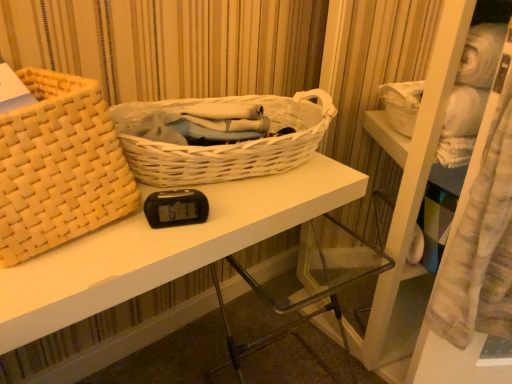
Question: Considering the relative positions of white wicker basket at center, acting as the 2th picnic basket starting from the left, and white woven basket at upper left in the image provided, is white wicker basket at center, acting as the 2th picnic basket starting from the left, to the right of white woven basket at upper left from the viewer's perspective?

Choices:
 (A) no
 (B) yes

Answer: (B)

Question: Can you see white wicker basket at center, acting as the 2th picnic basket starting from the left, touching white woven basket at upper left?

Choices:
 (A) yes
 (B) no

Answer: (B)

Question: Is white wicker basket at center, acting as the 2th picnic basket starting from the left, facing away from white woven basket at upper left?

Choices:
 (A) yes
 (B) no

Answer: (B)

Question: Would you say white woven basket at upper left is part of white wicker basket at center, arranged as the first picnic basket when viewed from the right,'s contents?

Choices:
 (A) no
 (B) yes

Answer: (A)

Question: Considering the relative sizes of white wicker basket at center, acting as the 2th picnic basket starting from the left, and white woven basket at upper left in the image provided, is white wicker basket at center, acting as the 2th picnic basket starting from the left, taller than white woven basket at upper left?

Choices:
 (A) yes
 (B) no

Answer: (B)

Question: Relative to white woven basket at upper left, is white wicker basket at center, acting as the 2th picnic basket starting from the left, in front or behind?

Choices:
 (A) behind
 (B) front

Answer: (A)

Question: From the image's perspective, relative to white woven basket at upper left, is white wicker basket at center, acting as the 2th picnic basket starting from the left, above or below?

Choices:
 (A) below
 (B) above

Answer: (B)

Question: Is white wicker basket at center, arranged as the first picnic basket when viewed from the right, wider or thinner than white woven basket at upper left?

Choices:
 (A) thin
 (B) wide

Answer: (A)

Question: Considering the positions of white wicker basket at center, acting as the 2th picnic basket starting from the left, and white woven basket at upper left in the image, is white wicker basket at center, acting as the 2th picnic basket starting from the left, bigger or smaller than white woven basket at upper left?

Choices:
 (A) small
 (B) big

Answer: (A)

Question: In terms of width, does white woven basket at upper left look wider or thinner when compared to matte woven picnic basket at left, positioned as the 1th picnic basket in left-to-right order?

Choices:
 (A) thin
 (B) wide

Answer: (B)

Question: Relative to matte woven picnic basket at left, positioned as the 1th picnic basket in left-to-right order, is white woven basket at upper left in front or behind?

Choices:
 (A) behind
 (B) front

Answer: (A)

Question: Is white woven basket at upper left to the left or to the right of matte woven picnic basket at left, positioned as the 1th picnic basket in left-to-right order, in the image?

Choices:
 (A) left
 (B) right

Answer: (B)

Question: Would you say white woven basket at upper left is inside or outside matte woven picnic basket at left, positioned as the 1th picnic basket in left-to-right order?

Choices:
 (A) outside
 (B) inside

Answer: (A)

Question: Looking at the image, does white wicker basket at center, arranged as the first picnic basket when viewed from the right, seem bigger or smaller compared to matte woven picnic basket at left, the 2th picnic basket when ordered from right to left?

Choices:
 (A) small
 (B) big

Answer: (A)

Question: Is white wicker basket at center, arranged as the first picnic basket when viewed from the right, in front of or behind matte woven picnic basket at left, the 2th picnic basket when ordered from right to left, in the image?

Choices:
 (A) front
 (B) behind

Answer: (B)